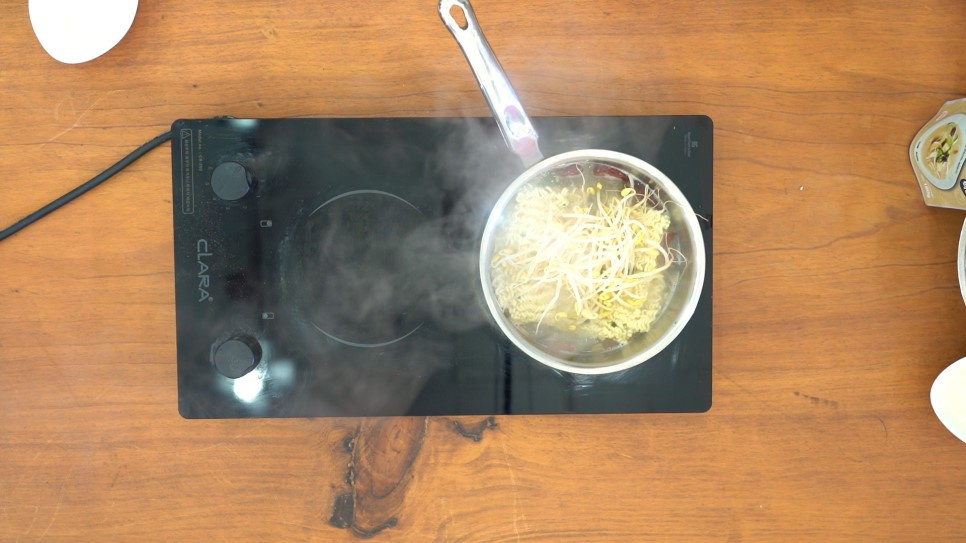
I want to click on pot, so click(689, 282).